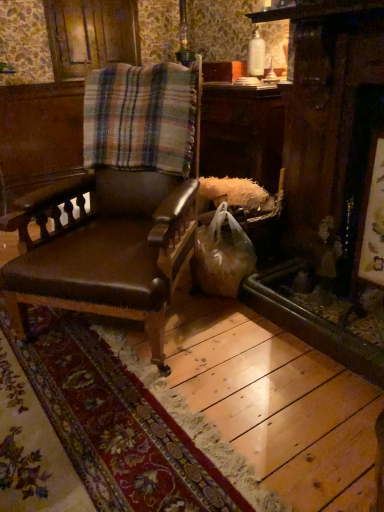
You are a GUI agent. You are given a task and a screenshot of the screen. Output one action in this format:
    pyautogui.click(x=<x>, y=<y>)
    Task: Click on the free space in front of translucent plastic bag at lower right
    
    Given the screenshot: What is the action you would take?
    pyautogui.click(x=225, y=318)